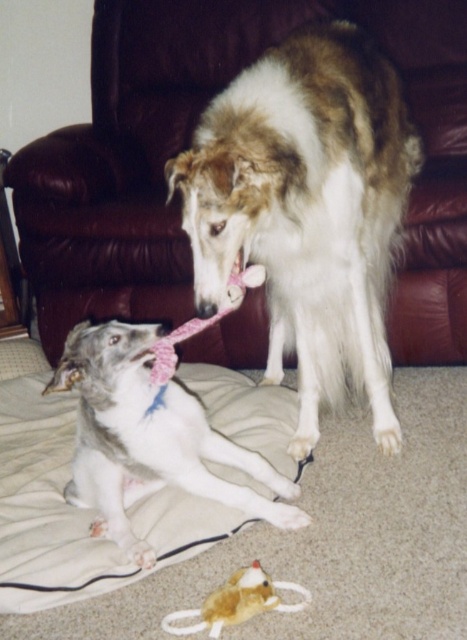
What do you see at coordinates (188, 145) in the screenshot? I see `brown leather armchair at upper center` at bounding box center [188, 145].

Can you confirm if brown leather armchair at upper center is shorter than white fur dog at center?

No.

The height and width of the screenshot is (640, 467). What do you see at coordinates (188, 145) in the screenshot?
I see `brown leather armchair at upper center` at bounding box center [188, 145].

Image resolution: width=467 pixels, height=640 pixels. I want to click on brown leather armchair at upper center, so click(188, 145).

Who is more distant from viewer, [280,365] or [128,340]?

The point [280,365] is more distant.

Who is more distant from viewer, (x=333, y=218) or (x=96, y=413)?

Point (x=333, y=218)

The image size is (467, 640). What are the coordinates of `white fur dog at center` in the screenshot? It's located at (308, 211).

Can you confirm if white fur dog at lower left is taller than pink fabric neckband at center?

Indeed, white fur dog at lower left has a greater height compared to pink fabric neckband at center.

Is white fur dog at lower left further to camera compared to pink fabric neckband at center?

No, it is not.

Where is `white fur dog at lower left`? white fur dog at lower left is located at coordinates (148, 438).

Find the location of a particular element. white fur dog at lower left is located at coordinates (148, 438).